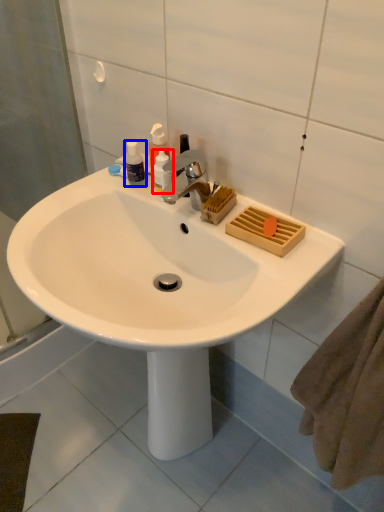
Question: Which point is further to the camera, toiletry (highlighted by a red box) or toiletry (highlighted by a blue box)?

Choices:
 (A) toiletry
 (B) toiletry

Answer: (B)